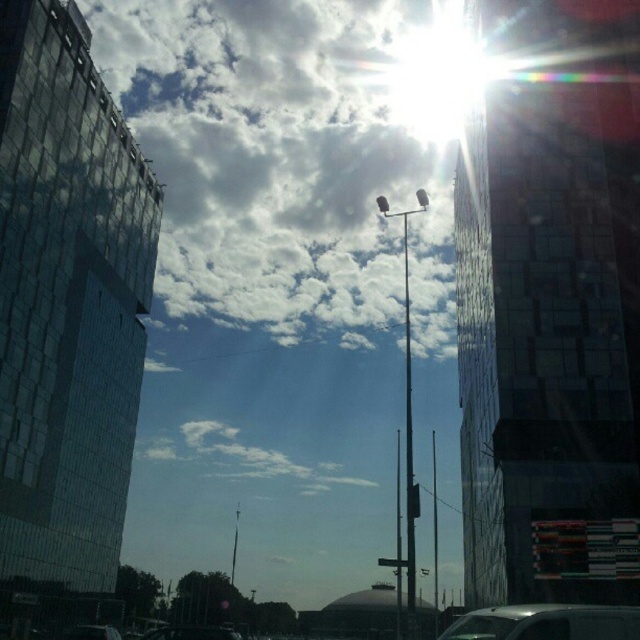
You are standing in the middle of the street looking at two points in the image. The first point is at coordinates point (605, 630) and the second is at point (410, 490). Which point is closer to your current position?

Point (605, 630) is closer to the camera than point (410, 490), so the first point is closer to your current position.

You are a delivery driver approaching the intersection and see the metallic silver van at center and the metallic traffic light at center. Which object would block your view more if you need to look past them?

The metallic silver van at center is larger in size than the metallic traffic light at center, so it would block your view more when looking past them.